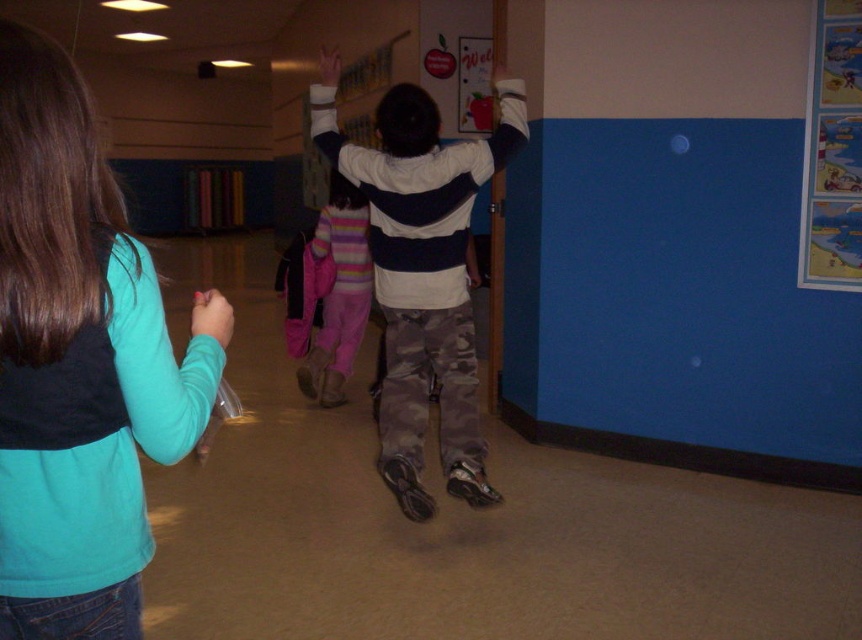
Is point (36, 307) farther from camera compared to point (408, 336)?

No, (36, 307) is in front of (408, 336).

Who is higher up, teal fabric shirt at left or camouflage pants at center?

camouflage pants at center is higher up.

Where is `teal fabric shirt at left`? This screenshot has height=640, width=862. teal fabric shirt at left is located at coordinates [x=80, y=364].

Does point (383, 392) come closer to viewer compared to point (815, 36)?

That is True.

You are a GUI agent. You are given a task and a screenshot of the screen. Output one action in this format:
    pyautogui.click(x=<x>, y=<y>)
    Task: Click on the camouflage pants at center
    
    Given the screenshot: What is the action you would take?
    pyautogui.click(x=422, y=273)

Identify the location of camouflage pants at center. (422, 273).

Who is lower down, teal fabric shirt at left or cartoon-themed posters at right?

teal fabric shirt at left is below.

Find the location of a particular element. This screenshot has height=640, width=862. teal fabric shirt at left is located at coordinates (80, 364).